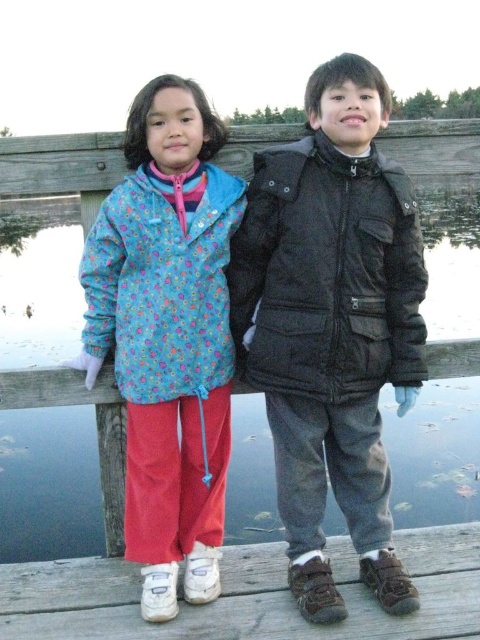
You are a photographer trying to capture both the floral fabric jacket at center and the wooden dock at lower center in the same frame. Based on their sizes, which object should you focus on first to ensure both are fully visible in the photo?

The floral fabric jacket at center is bigger than the wooden dock at lower center, so you should focus on the floral fabric jacket at center first to ensure both are fully visible in the photo.

You are a photographer trying to capture both the matte black jacket at center and the wooden dock at lower center in the same frame. Based on their sizes, which object should you focus on first to ensure both are visible in the photo?

The matte black jacket at center is much taller than the wooden dock at lower center, so you should focus on the matte black jacket at center first to ensure both are visible in the photo.